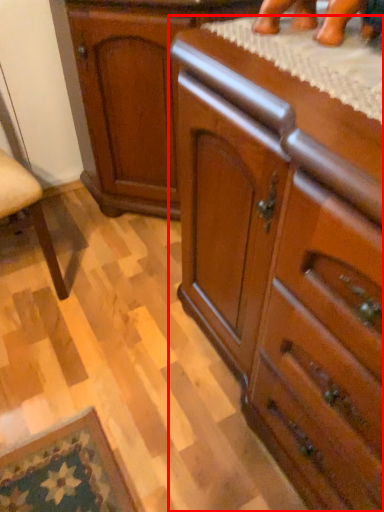
Question: Where is chest of drawers (annotated by the red box) located in relation to cabinetry in the image?

Choices:
 (A) left
 (B) right

Answer: (B)